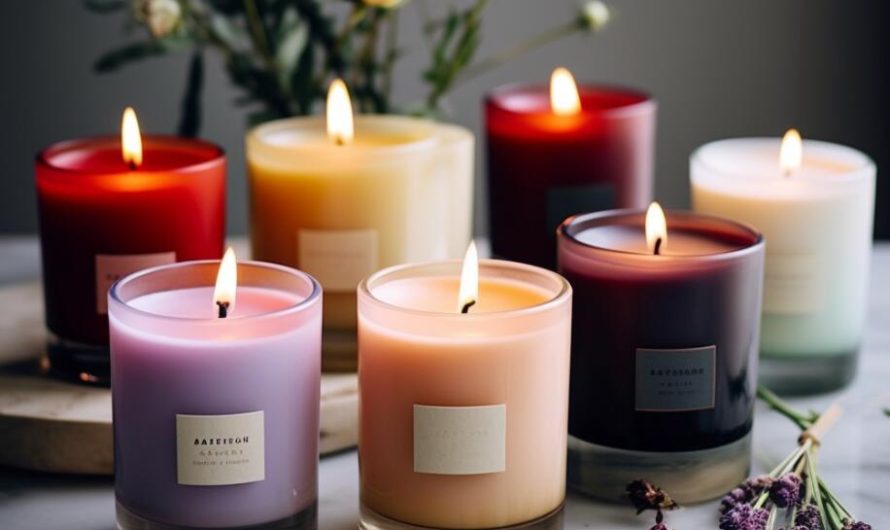
Locate an element on the screen. The image size is (890, 530). candles is located at coordinates click(x=154, y=220), click(x=361, y=201), click(x=576, y=176), click(x=798, y=246), click(x=238, y=386), click(x=466, y=373), click(x=678, y=317).